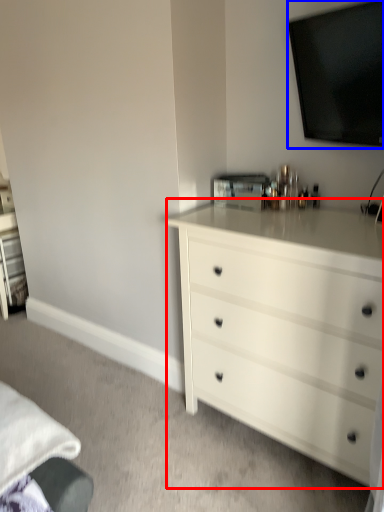
Question: Among these objects, which one is nearest to the camera, chest of drawers (highlighted by a red box) or television (highlighted by a blue box)?

Choices:
 (A) chest of drawers
 (B) television

Answer: (A)